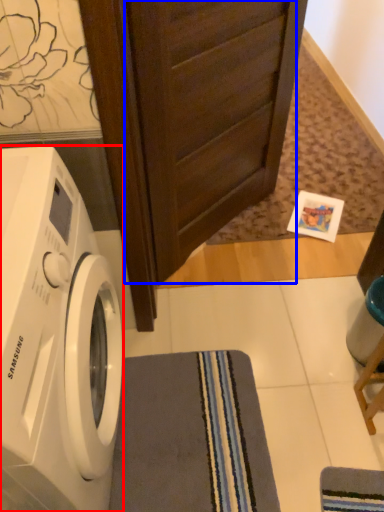
Question: Which object appears closest to the camera in this image, washing machine (highlighted by a red box) or screen door (highlighted by a blue box)?

Choices:
 (A) washing machine
 (B) screen door

Answer: (A)